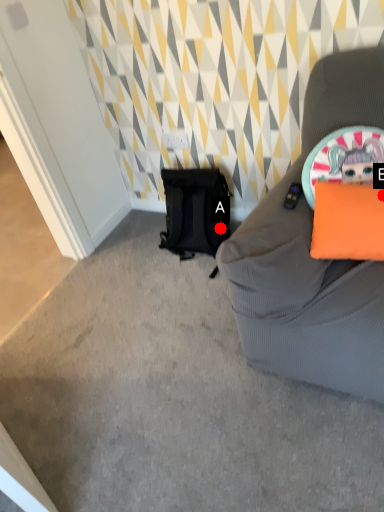
Question: Two points are circled on the image, labeled by A and B beside each circle. Among these points, which one is nearest to the camera?

Choices:
 (A) A is closer
 (B) B is closer

Answer: (B)